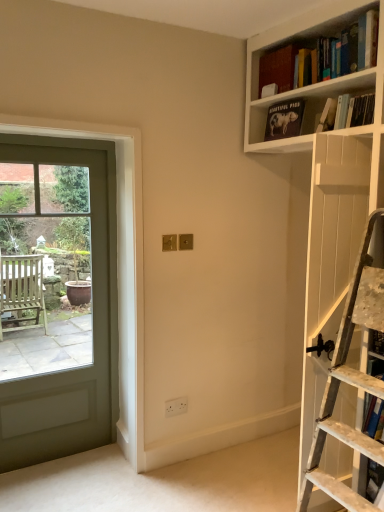
Question: Can you confirm if blue hardcover book at right, which is the 5th book in top-to-bottom order, is taller than matte glass door at left?

Choices:
 (A) no
 (B) yes

Answer: (A)

Question: From a real-world perspective, does blue hardcover book at right, the 1th book positioned from the bottom, sit lower than matte glass door at left?

Choices:
 (A) no
 (B) yes

Answer: (B)

Question: Is blue hardcover book at right, the 1th book positioned from the bottom, shorter than matte glass door at left?

Choices:
 (A) yes
 (B) no

Answer: (A)

Question: Is blue hardcover book at right, the 1th book positioned from the bottom, bigger than matte glass door at left?

Choices:
 (A) yes
 (B) no

Answer: (B)

Question: Can you confirm if blue hardcover book at right, the 1th book positioned from the bottom, is wider than matte glass door at left?

Choices:
 (A) no
 (B) yes

Answer: (B)

Question: From a real-world perspective, relative to matte black book at upper right, acting as the 2th book starting from the top, is matte glass door at left vertically above or below?

Choices:
 (A) above
 (B) below

Answer: (B)

Question: Looking at the image, does matte glass door at left seem bigger or smaller compared to matte black book at upper right, acting as the 4th book starting from the bottom?

Choices:
 (A) small
 (B) big

Answer: (B)

Question: Considering their positions, is matte glass door at left located in front of or behind matte black book at upper right, acting as the 2th book starting from the top?

Choices:
 (A) front
 (B) behind

Answer: (A)

Question: Choose the correct answer: Is matte glass door at left inside matte black book at upper right, acting as the 2th book starting from the top, or outside it?

Choices:
 (A) inside
 (B) outside

Answer: (B)

Question: Would you say matte glass door at left is to the left or to the right of hardcover book at upper right, the fifth book in the bottom-to-top sequence, in the picture?

Choices:
 (A) right
 (B) left

Answer: (B)

Question: From the image's perspective, relative to hardcover book at upper right, acting as the 1th book starting from the top, is matte glass door at left above or below?

Choices:
 (A) below
 (B) above

Answer: (A)

Question: From a real-world perspective, is matte glass door at left positioned above or below hardcover book at upper right, the fifth book in the bottom-to-top sequence?

Choices:
 (A) below
 (B) above

Answer: (A)

Question: Is matte glass door at left inside the boundaries of hardcover book at upper right, acting as the 1th book starting from the top, or outside?

Choices:
 (A) inside
 (B) outside

Answer: (B)

Question: In terms of width, does hardcover book at upper right, the second book in the bottom-to-top sequence, look wider or thinner when compared to matte black book at upper right, acting as the 4th book starting from the bottom?

Choices:
 (A) thin
 (B) wide

Answer: (B)

Question: Visually, is hardcover book at upper right, the fourth book when ordered from top to bottom, positioned to the left or to the right of matte black book at upper right, acting as the 2th book starting from the top?

Choices:
 (A) left
 (B) right

Answer: (B)